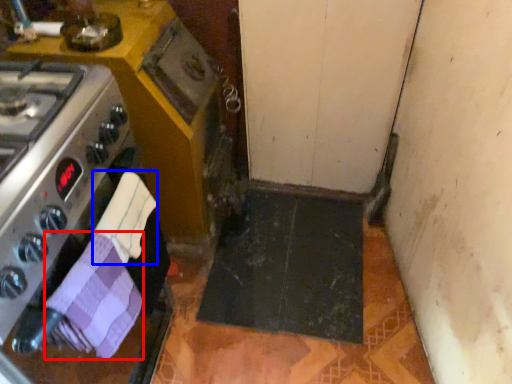
Question: Which object is further to the camera taking this photo, hand towel (highlighted by a red box) or hand towel (highlighted by a blue box)?

Choices:
 (A) hand towel
 (B) hand towel

Answer: (B)